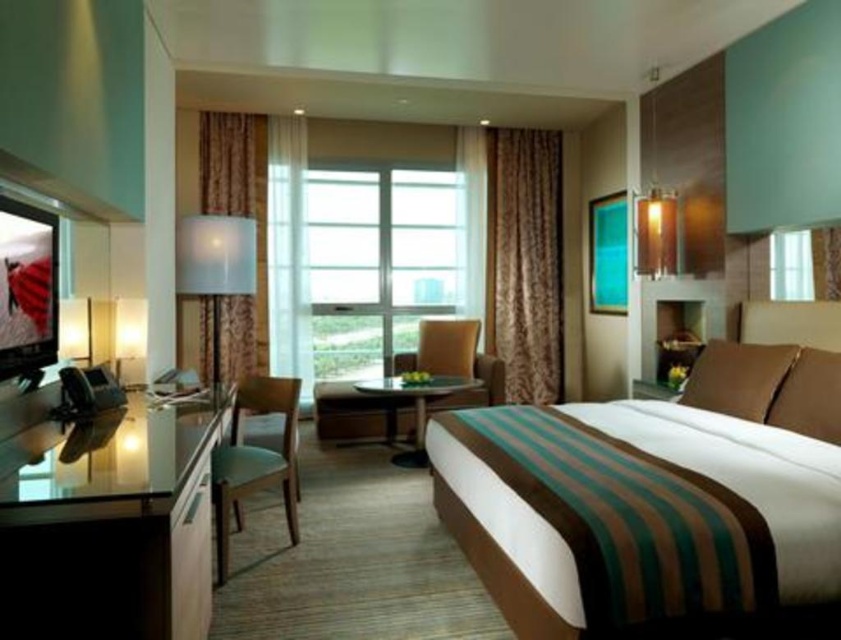
Question: In this image, where is white fabric lampshade at upper center located relative to glass top table at center?

Choices:
 (A) right
 (B) left

Answer: (B)

Question: Which of the following is the farthest from the observer?

Choices:
 (A) (242, 355)
 (B) (337, 256)
 (C) (422, 410)
 (D) (713, 490)

Answer: (B)

Question: Which of these objects is positioned farthest from the brown fabric curtain at left?

Choices:
 (A) brown textured curtain at center
 (B) white fabric lampshade at upper center

Answer: (A)

Question: Can you confirm if clear glass table at left is positioned to the right of brown leather stool at center?

Choices:
 (A) no
 (B) yes

Answer: (A)

Question: Does brown fabric curtain at left have a lesser width compared to brown leather stool at center?

Choices:
 (A) yes
 (B) no

Answer: (A)

Question: Which point is closer to the camera taking this photo?

Choices:
 (A) (437, 376)
 (B) (501, 262)
 (C) (182, 224)
 (D) (643, 106)

Answer: (C)